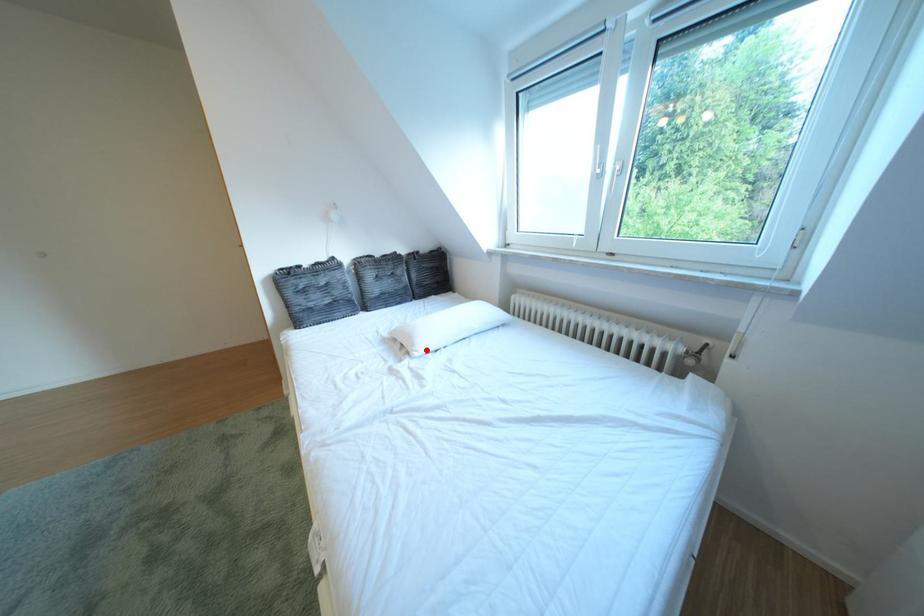
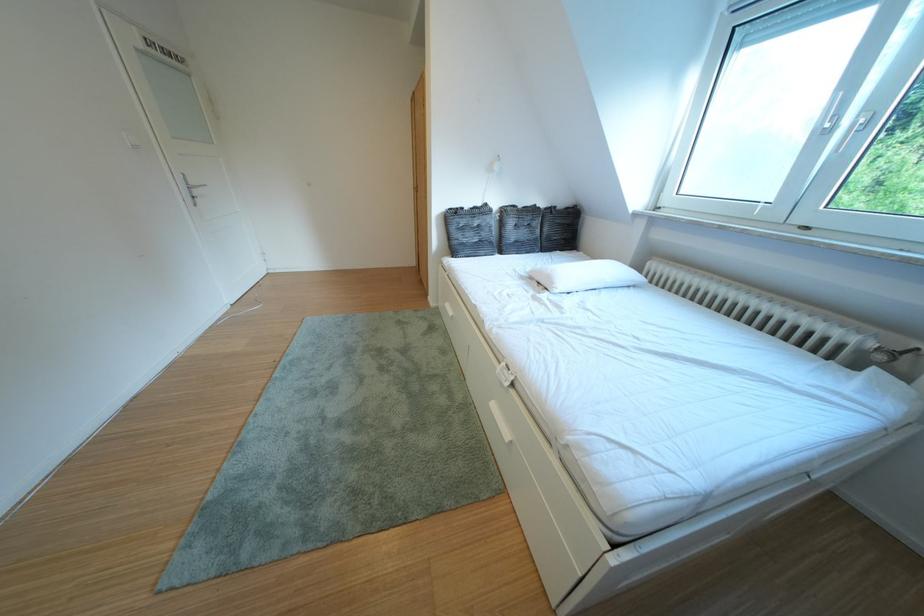
In the second image, find the point that corresponds to the highlighted location in the first image.

(565, 288)